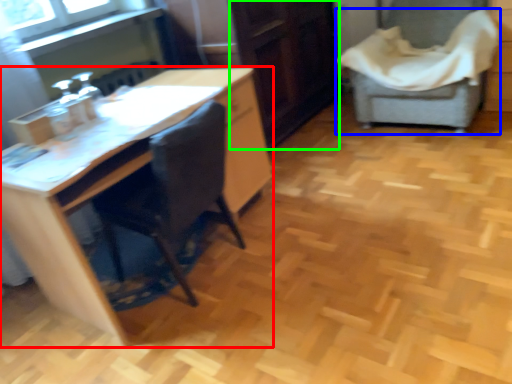
Question: Estimate the real-world distances between objects in this image. Which object is closer to desk (highlighted by a red box), chair (highlighted by a blue box) or file cabinet (highlighted by a green box)?

Choices:
 (A) chair
 (B) file cabinet

Answer: (B)